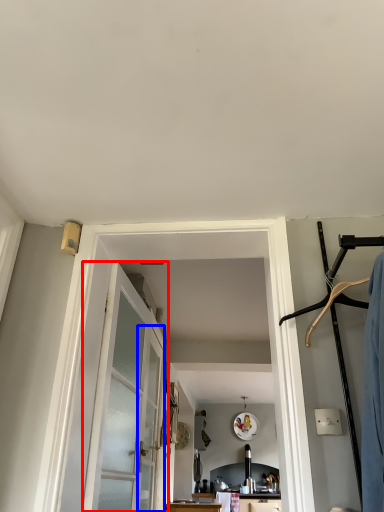
Question: Which object appears closest to the camera in this image, door (highlighted by a red box) or screen door (highlighted by a blue box)?

Choices:
 (A) door
 (B) screen door

Answer: (A)